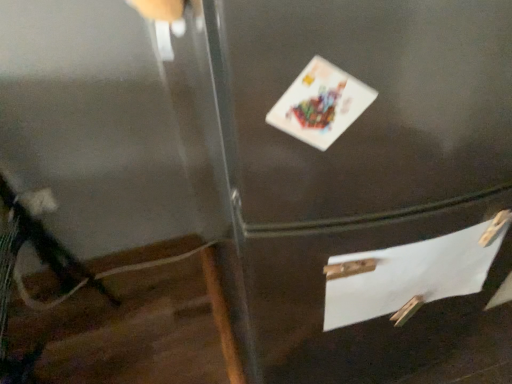
Question: Would you consider white paper at lower right to be distant from white paper postcard at upper center?

Choices:
 (A) yes
 (B) no

Answer: (B)

Question: From the image's perspective, is white paper at lower right on white paper postcard at upper center?

Choices:
 (A) yes
 (B) no

Answer: (B)

Question: Considering the relative sizes of white paper at lower right and white paper postcard at upper center in the image provided, is white paper at lower right wider than white paper postcard at upper center?

Choices:
 (A) yes
 (B) no

Answer: (B)

Question: Is white paper at lower right closer to camera compared to white paper postcard at upper center?

Choices:
 (A) no
 (B) yes

Answer: (A)

Question: Is white paper at lower right completely or partially outside of white paper postcard at upper center?

Choices:
 (A) yes
 (B) no

Answer: (A)

Question: From a real-world perspective, is white paper at lower right positioned over white paper postcard at upper center based on gravity?

Choices:
 (A) yes
 (B) no

Answer: (B)

Question: Would you say white paper postcard at upper center is outside white paper at lower right?

Choices:
 (A) no
 (B) yes

Answer: (B)

Question: Does white paper postcard at upper center have a greater height compared to white paper at lower right?

Choices:
 (A) no
 (B) yes

Answer: (A)

Question: Considering the relative sizes of white paper postcard at upper center and white paper at lower right in the image provided, is white paper postcard at upper center smaller than white paper at lower right?

Choices:
 (A) no
 (B) yes

Answer: (B)

Question: From the image's perspective, is white paper postcard at upper center on top of white paper at lower right?

Choices:
 (A) yes
 (B) no

Answer: (A)

Question: Considering the relative sizes of white paper postcard at upper center and white paper at lower right in the image provided, is white paper postcard at upper center thinner than white paper at lower right?

Choices:
 (A) no
 (B) yes

Answer: (A)

Question: Is white paper postcard at upper center facing towards white paper at lower right?

Choices:
 (A) no
 (B) yes

Answer: (A)

Question: From a real-world perspective, relative to white paper at lower right, is white paper postcard at upper center vertically above or below?

Choices:
 (A) above
 (B) below

Answer: (A)